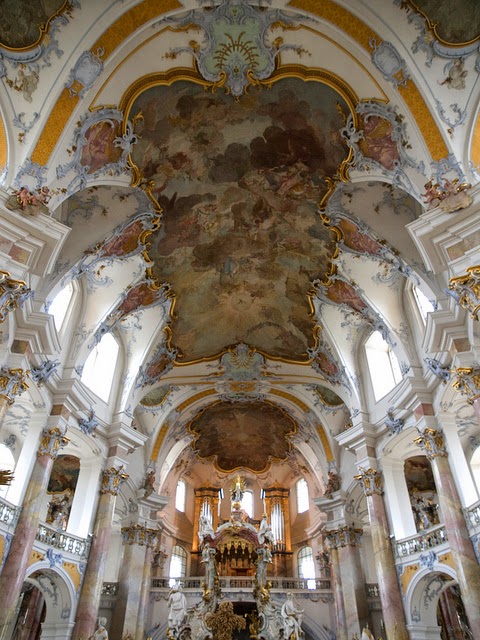
Where is `fancy ceiling`? fancy ceiling is located at coordinates (252, 317).